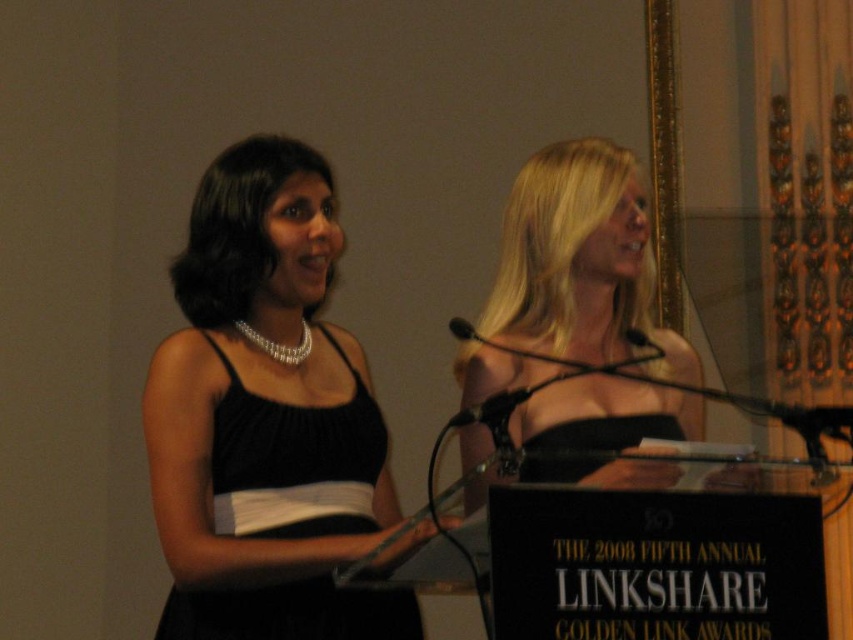
Does point (271, 262) come in front of point (494, 404)?

No, it is not.

Does black satin dress at center have a greater width compared to black plastic microphone at center?

Correct, the width of black satin dress at center exceeds that of black plastic microphone at center.

Who is more distant from viewer, (x=318, y=516) or (x=502, y=396)?

The point (x=318, y=516) is more distant.

You are a GUI agent. You are given a task and a screenshot of the screen. Output one action in this format:
    pyautogui.click(x=<x>, y=<y>)
    Task: Click on the black satin dress at center
    Image resolution: width=853 pixels, height=640 pixels.
    Given the screenshot: What is the action you would take?
    pyautogui.click(x=265, y=417)

Measure the distance from blonde hair at center to black plastic microphone at center.

blonde hair at center is 18.06 inches away from black plastic microphone at center.

Is point (537, 401) positioned behind point (486, 401)?

Yes, point (537, 401) is farther from viewer.

I want to click on blonde hair at center, so click(579, 260).

Between point (503, 410) and point (469, 326), which one is positioned in front?

Point (503, 410) is in front.

Is black plastic microphone at center wider than black matte microphone at center?

Yes.

You are a GUI agent. You are given a task and a screenshot of the screen. Output one action in this format:
    pyautogui.click(x=<x>, y=<y>)
    Task: Click on the black plastic microphone at center
    This screenshot has width=853, height=640.
    Given the screenshot: What is the action you would take?
    pyautogui.click(x=490, y=410)